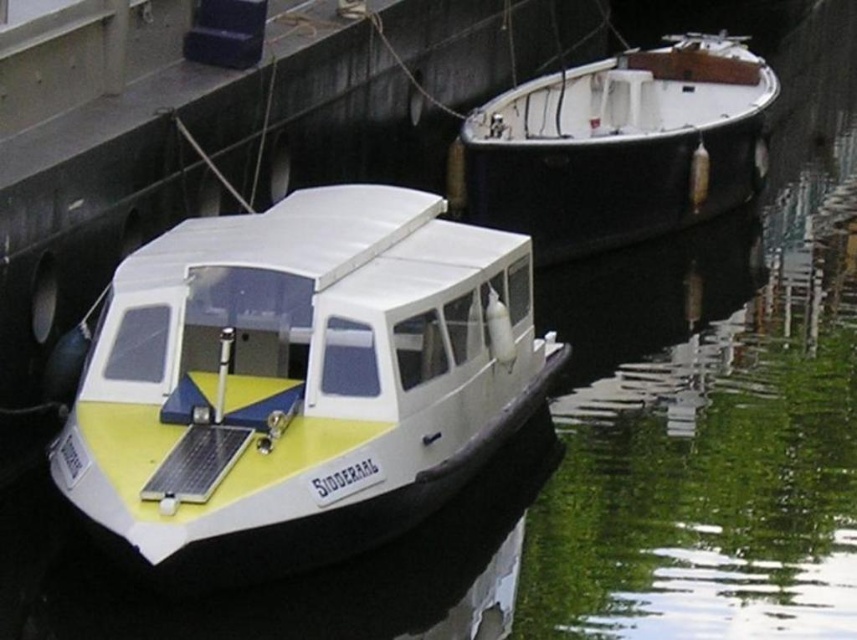
Question: Among these points, which one is farthest from the camera?

Choices:
 (A) (505, 337)
 (B) (748, 195)

Answer: (B)

Question: Is yellow matte boat at center smaller than black polished wood boat at upper right?

Choices:
 (A) no
 (B) yes

Answer: (A)

Question: Does yellow matte boat at center appear over black polished wood boat at upper right?

Choices:
 (A) no
 (B) yes

Answer: (A)

Question: Does yellow matte boat at center appear under black polished wood boat at upper right?

Choices:
 (A) yes
 (B) no

Answer: (A)

Question: Which point is closer to the camera taking this photo?

Choices:
 (A) (586, 124)
 (B) (201, 442)

Answer: (B)